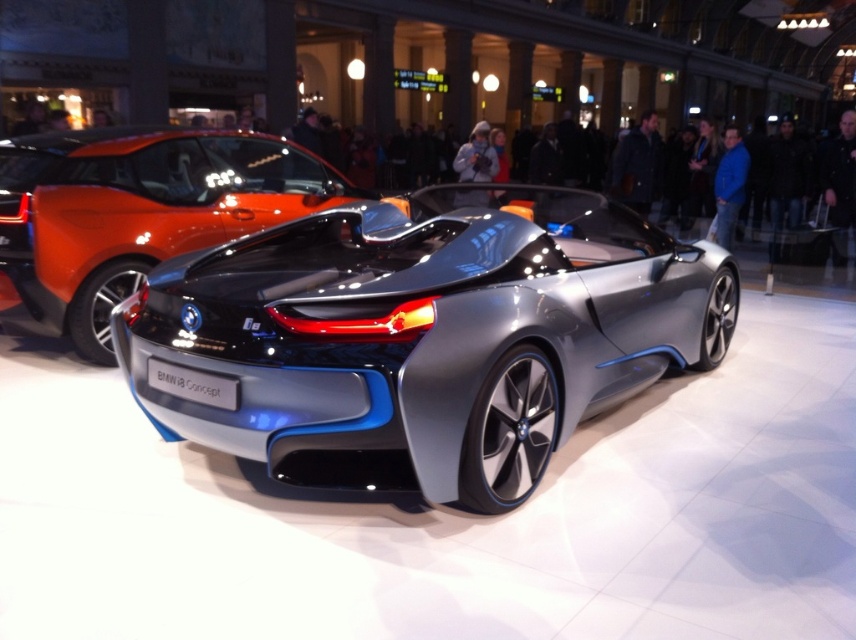
Question: Which object appears farthest from the camera in this image?

Choices:
 (A) shiny metallic car at center
 (B) sleek metallic car at center

Answer: (A)

Question: Can you confirm if sleek metallic car at center is positioned below shiny metallic car at center?

Choices:
 (A) no
 (B) yes

Answer: (B)

Question: Which of the following is the closest to the observer?

Choices:
 (A) (135, 353)
 (B) (233, 150)

Answer: (A)

Question: Which point is farther to the camera?

Choices:
 (A) sleek metallic car at center
 (B) shiny metallic car at center

Answer: (B)

Question: Does sleek metallic car at center appear under shiny metallic car at center?

Choices:
 (A) yes
 (B) no

Answer: (A)

Question: Can you confirm if sleek metallic car at center is smaller than shiny metallic car at center?

Choices:
 (A) no
 (B) yes

Answer: (A)